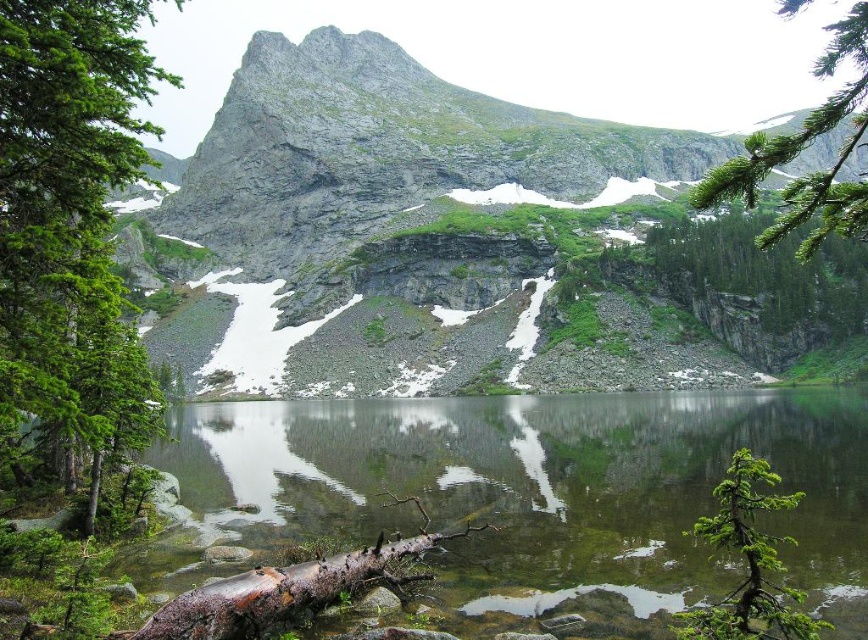
Question: Which point appears closest to the camera in this image?

Choices:
 (A) (27, 140)
 (B) (801, 506)

Answer: (A)

Question: Is the position of green matte tree at left more distant than that of green matte tree at lower right?

Choices:
 (A) yes
 (B) no

Answer: (A)

Question: Observing the image, what is the correct spatial positioning of green needle-like leaves at upper right in reference to green matte tree at lower right?

Choices:
 (A) above
 (B) below

Answer: (A)

Question: Which point is farther to the camera?

Choices:
 (A) (342, 186)
 (B) (336, 579)
 (C) (754, 632)

Answer: (A)

Question: Among these points, which one is nearest to the camera?

Choices:
 (A) (264, 616)
 (B) (198, 486)

Answer: (A)

Question: Is green matte tree at left thinner than rusty wood log at lower center?

Choices:
 (A) no
 (B) yes

Answer: (A)